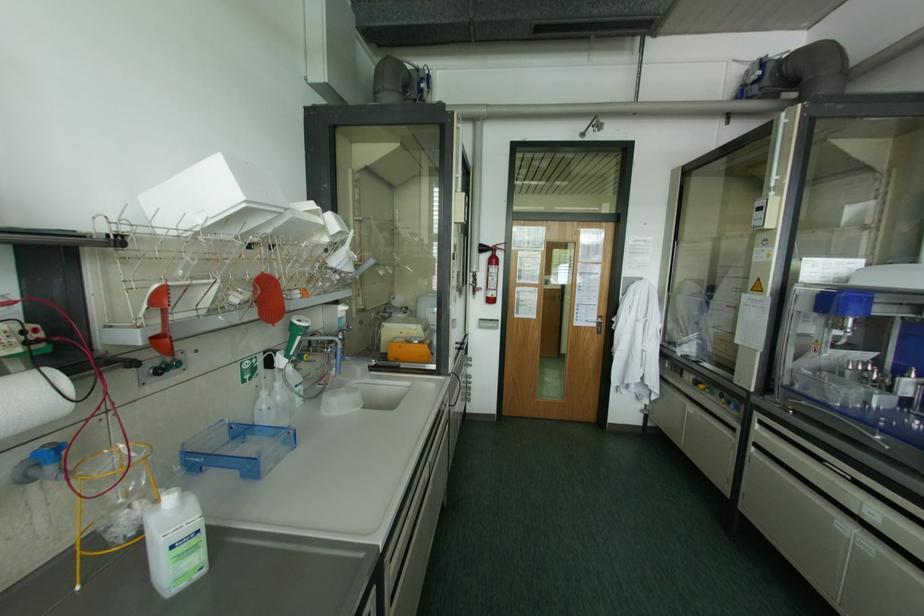
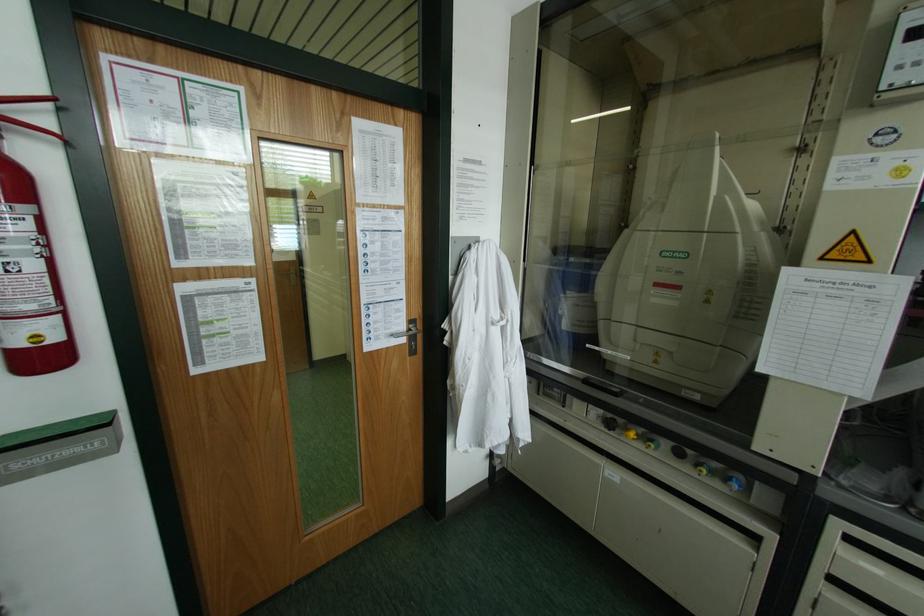
In the second image, find the point that corresponds to (599,315) in the first image.

(409, 321)